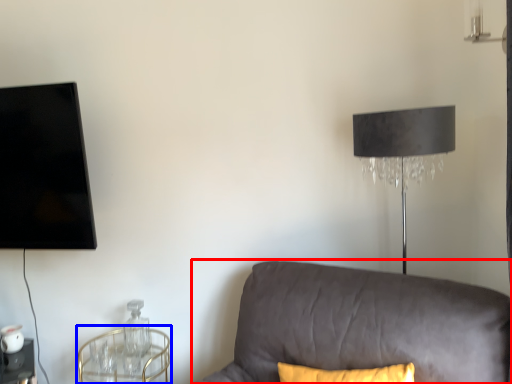
Question: Which object appears closest to the camera in this image, studio couch (highlighted by a red box) or round table (highlighted by a blue box)?

Choices:
 (A) studio couch
 (B) round table

Answer: (A)